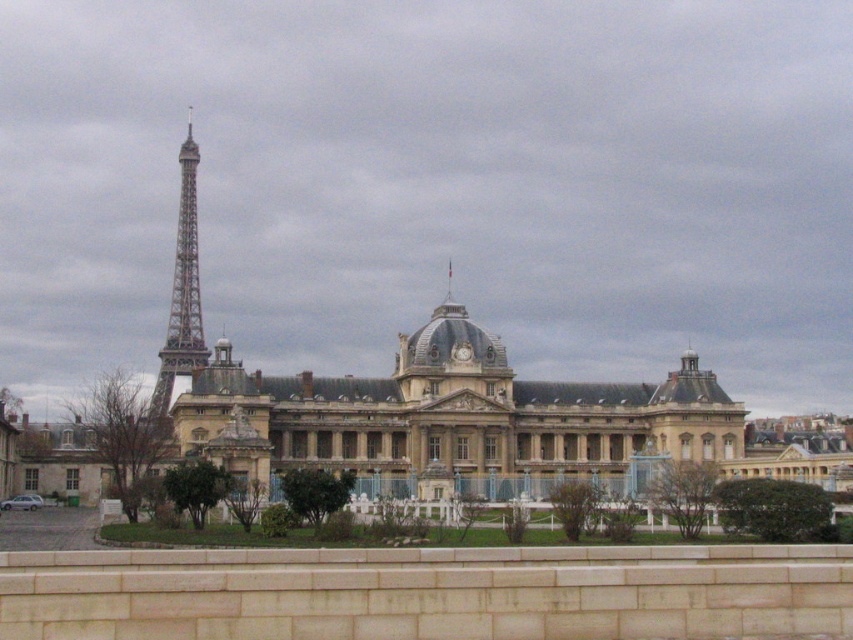
Question: Is the position of brown stone building at center more distant than that of painted steel eiffel tower at left?

Choices:
 (A) yes
 (B) no

Answer: (B)

Question: Does brown stone building at center lie in front of painted steel eiffel tower at left?

Choices:
 (A) yes
 (B) no

Answer: (A)

Question: Which object is closer to the camera taking this photo?

Choices:
 (A) painted steel eiffel tower at left
 (B) brown stone building at center

Answer: (B)

Question: Which of the following is the farthest from the observer?

Choices:
 (A) brown stone building at center
 (B) painted steel eiffel tower at left

Answer: (B)

Question: Among these objects, which one is nearest to the camera?

Choices:
 (A) painted steel eiffel tower at left
 (B) brown stone building at center

Answer: (B)

Question: Where is brown stone building at center located in relation to painted steel eiffel tower at left in the image?

Choices:
 (A) right
 (B) left

Answer: (A)